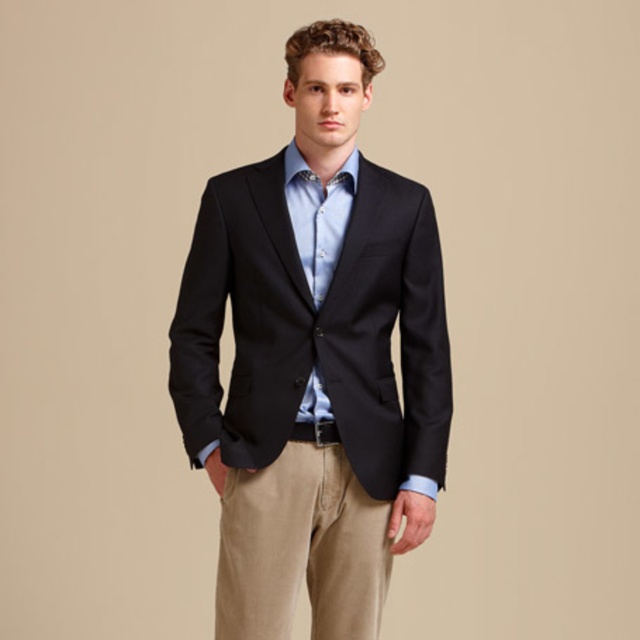
Question: Which of the following is the farthest from the observer?

Choices:
 (A) (330, 256)
 (B) (413, 200)
 (C) (380, 512)

Answer: (C)

Question: Does khaki cotton pants at lower center appear over light blue cotton shirt at center?

Choices:
 (A) yes
 (B) no

Answer: (B)

Question: Among these points, which one is nearest to the camera?

Choices:
 (A) (269, 465)
 (B) (252, 490)

Answer: (A)

Question: Is matte black blazer at center thinner than light blue cotton shirt at center?

Choices:
 (A) yes
 (B) no

Answer: (B)

Question: Considering the relative positions of matte black blazer at center and light blue cotton shirt at center in the image provided, where is matte black blazer at center located with respect to light blue cotton shirt at center?

Choices:
 (A) right
 (B) left

Answer: (B)

Question: Which is farther from the khaki cotton pants at lower center?

Choices:
 (A) light blue cotton shirt at center
 (B) matte black blazer at center

Answer: (A)